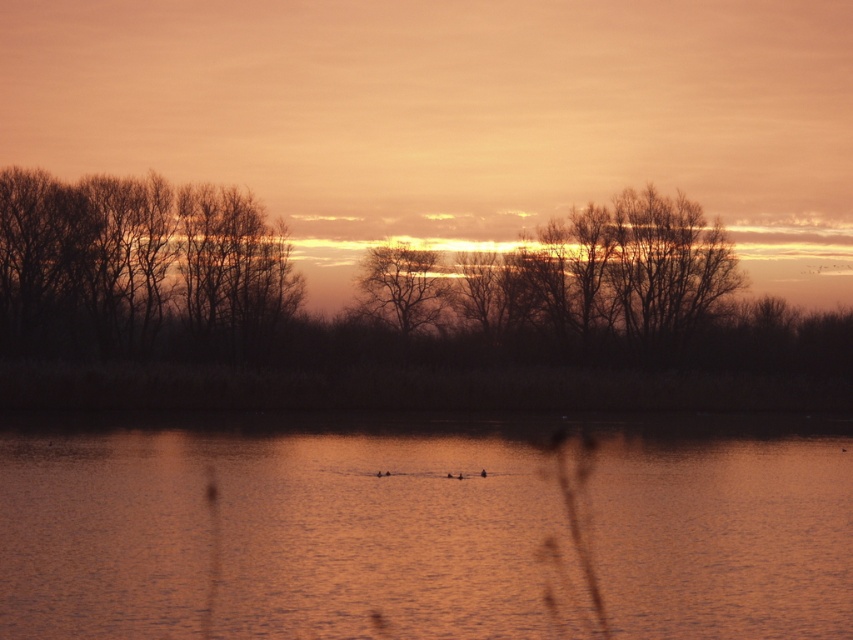
Question: Does orange reflective water at center lie behind bare branches at left?

Choices:
 (A) no
 (B) yes

Answer: (A)

Question: Can you confirm if orange reflective water at center is smaller than silhouette bare tree at center?

Choices:
 (A) no
 (B) yes

Answer: (A)

Question: Estimate the real-world distances between objects in this image. Which object is farther from the orange reflective water at center?

Choices:
 (A) bare branches at left
 (B) silhouette bare tree at center

Answer: (B)

Question: Observing the image, what is the correct spatial positioning of bare branches at left in reference to silhouette bare tree at center?

Choices:
 (A) right
 (B) left

Answer: (B)

Question: Estimate the real-world distances between objects in this image. Which object is closer to the orange reflective water at center?

Choices:
 (A) silhouette bare tree at center
 (B) bare branches at left

Answer: (B)

Question: Which point appears closest to the camera in this image?

Choices:
 (A) (814, 605)
 (B) (248, 342)
 (C) (427, 317)

Answer: (A)